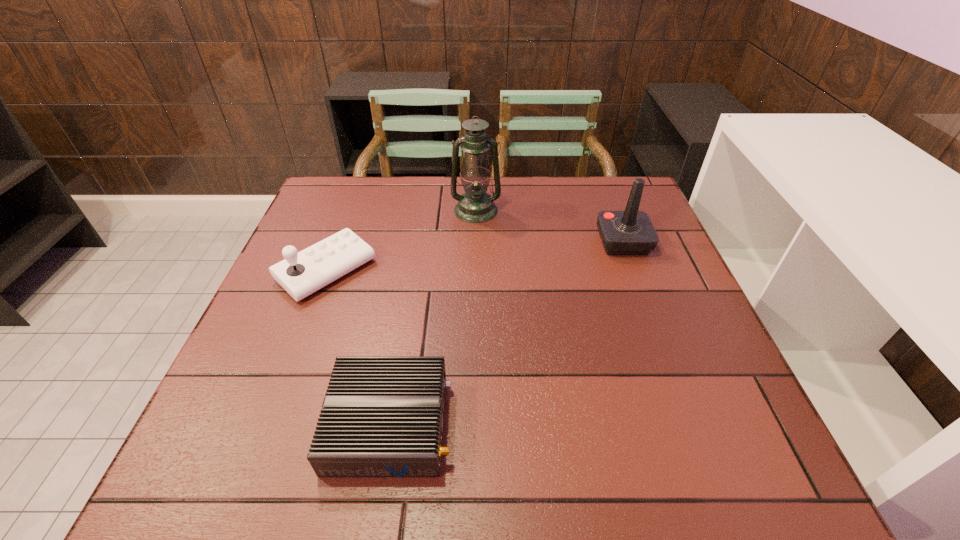
Identify the location of blank space at the near right corner. The image size is (960, 540). (696, 469).

At what (x,y) coordinates should I click in order to perform the action: click on vacant space that's between the oil lamp and the rightmost object. Please return your answer as a coordinate pair (x, y). This screenshot has height=540, width=960. Looking at the image, I should click on (549, 226).

What are the coordinates of `free space between the shortest object and the tallest object` in the screenshot? It's located at (433, 317).

At what (x,y) coordinates should I click in order to perform the action: click on free spot between the second tallest object and the router. Please return your answer as a coordinate pair (x, y). Image resolution: width=960 pixels, height=540 pixels. Looking at the image, I should click on (506, 333).

Where is `vacant area that lies between the shorter joystick and the oil lamp`? vacant area that lies between the shorter joystick and the oil lamp is located at coordinates (401, 240).

This screenshot has width=960, height=540. I want to click on vacant region between the nearest object and the oil lamp, so click(433, 317).

This screenshot has height=540, width=960. I want to click on blank region between the nearest object and the tallest object, so click(x=433, y=317).

Locate an element on the screen. The image size is (960, 540). vacant area that lies between the tallest object and the router is located at coordinates (433, 317).

Locate an element on the screen. The height and width of the screenshot is (540, 960). unoccupied position between the third tallest object and the router is located at coordinates (358, 347).

Locate an element on the screen. free area in between the oil lamp and the taller joystick is located at coordinates (549, 226).